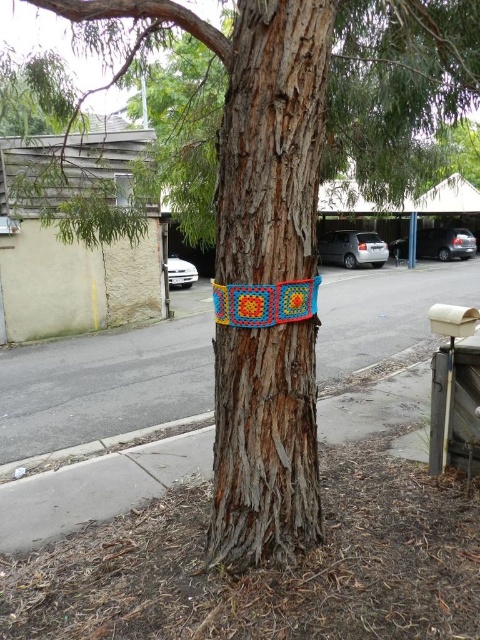
Which is above, wooden textured tree trunk at center or textured concrete pavement at center?

textured concrete pavement at center is higher up.

Between point (262, 72) and point (10, 436), which one is positioned in front?

Point (262, 72) is more forward.

Find the location of a particular element. wooden textured tree trunk at center is located at coordinates (272, 144).

Locate an element on the screen. Image resolution: width=480 pixels, height=640 pixels. textured concrete pavement at center is located at coordinates (105, 384).

Who is lower down, textured concrete pavement at center or knitted yarn blanket at center?

knitted yarn blanket at center is below.

Does point (179, 360) come in front of point (290, 280)?

That is False.

You are a GUI agent. You are given a task and a screenshot of the screen. Output one action in this format:
    pyautogui.click(x=<x>, y=<y>)
    Task: Click on the textured concrete pavement at center
    
    Given the screenshot: What is the action you would take?
    pyautogui.click(x=105, y=384)

Between wooden textured tree trunk at center and knitted yarn blanket at center, which one has less height?

knitted yarn blanket at center is shorter.

Does wooden textured tree trunk at center appear under knitted yarn blanket at center?

Incorrect, wooden textured tree trunk at center is not positioned below knitted yarn blanket at center.

What are the coordinates of `wooden textured tree trunk at center` in the screenshot? It's located at (272, 144).

I want to click on wooden textured tree trunk at center, so click(272, 144).